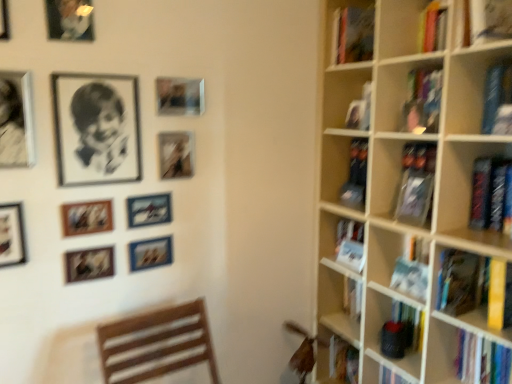
Identify the location of matte black picture frame at lower left, marked as the 1th picture frame in a bottom-to-top arrangement. (89, 264).

Where is `matte black picture frame at left, acting as the eighth picture frame starting from the top`? Image resolution: width=512 pixels, height=384 pixels. matte black picture frame at left, acting as the eighth picture frame starting from the top is located at coordinates (12, 235).

I want to click on hardcover book at upper right, which appears as the first book when viewed from the top, so click(488, 20).

What is the approximate height of metallic silver photo frame at center-left, arranged as the second picture frame when ordered from the bottom?

5.15 inches.

This screenshot has height=384, width=512. What do you see at coordinates (179, 96) in the screenshot?
I see `matte black picture frame at upper center, positioned as the eighth picture frame in bottom-to-top order` at bounding box center [179, 96].

How much space does matte black picture frame at upper center, the 6th picture frame from the bottom, occupy vertically?

It is 7.77 inches.

Find the location of a particular element. The image size is (512, 384). wooden bookcase at right is located at coordinates (399, 192).

Does blue hardcover book at upper right, which is the third book in bottom-to-top order, have a lesser width compared to matte black picture frame at upper center, the fifth picture frame when ordered from top to bottom?

In fact, blue hardcover book at upper right, which is the third book in bottom-to-top order, might be wider than matte black picture frame at upper center, the fifth picture frame when ordered from top to bottom.

Is blue hardcover book at upper right, which is the third book in bottom-to-top order, in contact with matte black picture frame at upper center, the 6th picture frame from the bottom?

blue hardcover book at upper right, which is the third book in bottom-to-top order, is not next to matte black picture frame at upper center, the 6th picture frame from the bottom, and they're not touching.

Can you tell me how much blue hardcover book at upper right, which is the third book in bottom-to-top order, and matte black picture frame at upper center, the 6th picture frame from the bottom, differ in facing direction?

90.6 degrees.

Is blue hardcover book at upper right, arranged as the 2th book when viewed from the top, at the right side of matte black picture frame at upper center, the fifth picture frame when ordered from top to bottom?

Yes, blue hardcover book at upper right, arranged as the 2th book when viewed from the top, is to the right of matte black picture frame at upper center, the fifth picture frame when ordered from top to bottom.

Find the location of `picture frame that is the 3rd object to the left of the black and white portrait at upper left, starting at the anchor`. picture frame that is the 3rd object to the left of the black and white portrait at upper left, starting at the anchor is located at coordinates (70, 20).

Is black and white portrait at upper left to the left or to the right of matte black picture frame at upper left, the tenth picture frame positioned from the bottom, in the image?

From the image, it's evident that black and white portrait at upper left is to the right of matte black picture frame at upper left, the tenth picture frame positioned from the bottom.

Are black and white portrait at upper left and matte black picture frame at upper left, the 1th picture frame in the top-to-bottom sequence, beside each other?

No, black and white portrait at upper left is not touching matte black picture frame at upper left, the 1th picture frame in the top-to-bottom sequence.

Looking at their sizes, would you say black and white portrait at upper left is wider or thinner than matte black picture frame at upper left, the tenth picture frame positioned from the bottom?

black and white portrait at upper left is wider than matte black picture frame at upper left, the tenth picture frame positioned from the bottom.

From the image's perspective, is metallic silver picture frame at upper left, which ranks as the ninth picture frame in bottom-to-top order, beneath blue hardcover book at upper right, which is the third book in bottom-to-top order?

Incorrect, from the image's perspective, metallic silver picture frame at upper left, which ranks as the ninth picture frame in bottom-to-top order, is higher than blue hardcover book at upper right, which is the third book in bottom-to-top order.

Consider the image. Which object is positioned more to the left, metallic silver picture frame at upper left, which ranks as the ninth picture frame in bottom-to-top order, or blue hardcover book at upper right, arranged as the 2th book when viewed from the top?

metallic silver picture frame at upper left, which ranks as the ninth picture frame in bottom-to-top order, is more to the left.

What's the angular difference between metallic silver picture frame at upper left, which is the 2th picture frame from top to bottom, and blue hardcover book at upper right, arranged as the 2th book when viewed from the top,'s facing directions?

They differ by 88.9 degrees in their facing directions.

Looking at this image, how distant is hardcover book at right, the first book in the bottom-to-top sequence, from metallic silver picture frame at upper left, which ranks as the ninth picture frame in bottom-to-top order?

The distance of hardcover book at right, the first book in the bottom-to-top sequence, from metallic silver picture frame at upper left, which ranks as the ninth picture frame in bottom-to-top order, is 2.06 meters.

From the image's perspective, does hardcover book at right, the first book in the bottom-to-top sequence, appear higher than metallic silver picture frame at upper left, which ranks as the ninth picture frame in bottom-to-top order?

Incorrect, from the image's perspective, hardcover book at right, the first book in the bottom-to-top sequence, is lower than metallic silver picture frame at upper left, which ranks as the ninth picture frame in bottom-to-top order.

Looking at this image, who is bigger, hardcover book at right, the first book in the bottom-to-top sequence, or metallic silver picture frame at upper left, which ranks as the ninth picture frame in bottom-to-top order?

Bigger between the two is hardcover book at right, the first book in the bottom-to-top sequence.

Is matte black picture frame at upper center, the 6th picture frame from the bottom, situated inside metallic silver picture frame at upper left, which is the 2th picture frame from top to bottom, or outside?

matte black picture frame at upper center, the 6th picture frame from the bottom, exists outside the volume of metallic silver picture frame at upper left, which is the 2th picture frame from top to bottom.

Is matte black picture frame at upper center, the 6th picture frame from the bottom, positioned before metallic silver picture frame at upper left, which is the 2th picture frame from top to bottom?

No.

Could you tell me if matte black picture frame at upper center, the fifth picture frame when ordered from top to bottom, is facing metallic silver picture frame at upper left, which is the 2th picture frame from top to bottom?

No.

Is matte black picture frame at upper left, the 1th picture frame in the top-to-bottom sequence, to the left of metallic silver picture frame at upper left, which ranks as the 7th picture frame in bottom-to-top order, from the viewer's perspective?

No, matte black picture frame at upper left, the 1th picture frame in the top-to-bottom sequence, is not to the left of metallic silver picture frame at upper left, which ranks as the 7th picture frame in bottom-to-top order.

Does point (67, 8) appear closer or farther from the camera than point (30, 135)?

Clearly, point (67, 8) is closer to the camera than point (30, 135).

From the image's perspective, is matte black picture frame at upper left, the 1th picture frame in the top-to-bottom sequence, located beneath metallic silver picture frame at upper left, which ranks as the 7th picture frame in bottom-to-top order?

Incorrect, from the image's perspective, matte black picture frame at upper left, the 1th picture frame in the top-to-bottom sequence, is higher than metallic silver picture frame at upper left, which ranks as the 7th picture frame in bottom-to-top order.

Between matte black picture frame at left, positioned as the third picture frame in bottom-to-top order, and blue hardcover book at upper right, arranged as the 2th book when viewed from the top, which one has less height?

matte black picture frame at left, positioned as the third picture frame in bottom-to-top order.

From the image's perspective, is matte black picture frame at left, acting as the eighth picture frame starting from the top, over blue hardcover book at upper right, arranged as the 2th book when viewed from the top?

Incorrect, from the image's perspective, matte black picture frame at left, acting as the eighth picture frame starting from the top, is lower than blue hardcover book at upper right, arranged as the 2th book when viewed from the top.

Does matte black picture frame at left, acting as the eighth picture frame starting from the top, have a greater width compared to blue hardcover book at upper right, which is the third book in bottom-to-top order?

In fact, matte black picture frame at left, acting as the eighth picture frame starting from the top, might be narrower than blue hardcover book at upper right, which is the third book in bottom-to-top order.

Considering their positions, is matte black picture frame at left, acting as the eighth picture frame starting from the top, located in front of or behind blue hardcover book at upper right, which is the third book in bottom-to-top order?

Clearly, matte black picture frame at left, acting as the eighth picture frame starting from the top, is in front of blue hardcover book at upper right, which is the third book in bottom-to-top order.

From the image's perspective, starting from the blue hardcover book at upper right, which is the third book in bottom-to-top order, which picture frame is the 2nd one below? Please provide its 2D coordinates.

[(176, 154)]

From the black and white portrait at upper left, count 1st picture frames forward and point to it. Please provide its 2D coordinates.

[(70, 20)]

From the image, which object appears to be farther from metallic silver picture frame at upper left, which ranks as the ninth picture frame in bottom-to-top order, matte black picture frame at left, acting as the eighth picture frame starting from the top, or hardcover book at upper right, which appears as the first book when viewed from the top?

Among the two, hardcover book at upper right, which appears as the first book when viewed from the top, is located further to metallic silver picture frame at upper left, which ranks as the ninth picture frame in bottom-to-top order.

When comparing their distances from metallic silver photo frame at center-left, arranged as the ninth picture frame when viewed from the top, does hardcover books at right or metallic silver airplane at upper left, arranged as the 6th picture frame when viewed from the top, seem further?

hardcover books at right.

When comparing their distances from hardcover book at upper right, marked as the fourth book in a bottom-to-top arrangement, does wooden chair at lower left or blue hardcover book at upper right, arranged as the 2th book when viewed from the top, seem closer?

blue hardcover book at upper right, arranged as the 2th book when viewed from the top, is closer to hardcover book at upper right, marked as the fourth book in a bottom-to-top arrangement.

Considering their positions, is metallic silver picture frame at upper left, the 4th picture frame viewed from the top, positioned further to metallic silver picture frame at upper left, which is the 2th picture frame from top to bottom, than hardcover books at right?

hardcover books at right is further to metallic silver picture frame at upper left, which is the 2th picture frame from top to bottom.

Based on their spatial positions, is matte black picture frame at upper center, the 6th picture frame from the bottom, or matte black picture frame at upper center, arranged as the third picture frame when viewed from the top, closer to hardcover book at right, marked as the 4th book in a top-to-bottom arrangement?

Among the two, matte black picture frame at upper center, the 6th picture frame from the bottom, is located nearer to hardcover book at right, marked as the 4th book in a top-to-bottom arrangement.

Considering their positions, is metallic silver picture frame at upper left, the 4th picture frame viewed from the top, positioned further to metallic silver photo frame at center-left, arranged as the ninth picture frame when viewed from the top, than matte wooden picture frame at upper left, the 7th picture frame positioned from the top?

Among the two, metallic silver picture frame at upper left, the 4th picture frame viewed from the top, is located further to metallic silver photo frame at center-left, arranged as the ninth picture frame when viewed from the top.

Which object lies nearer to the anchor point hardcover book at upper right, which appears as the first book when viewed from the top, hardcover books at right or hardcover book at right, positioned as the third book in top-to-bottom order?

hardcover books at right is positioned closer to the anchor hardcover book at upper right, which appears as the first book when viewed from the top.

In the scene shown: Based on their spatial positions, is metallic silver picture frame at upper left, which ranks as the 7th picture frame in bottom-to-top order, or metallic silver airplane at upper left, arranged as the 6th picture frame when viewed from the top, closer to hardcover book at upper right, marked as the fourth book in a bottom-to-top arrangement?

The object closer to hardcover book at upper right, marked as the fourth book in a bottom-to-top arrangement, is metallic silver airplane at upper left, arranged as the 6th picture frame when viewed from the top.

Identify the location of bookcase located between matte black picture frame at upper center, positioned as the eighth picture frame in bottom-to-top order, and hardcover book at right, positioned as the third book in top-to-bottom order, in the left-right direction. The image size is (512, 384). (399, 192).

Identify the location of chair located between black and white portrait at upper left and wooden bookcase at right in the left-right direction. (156, 344).

Where is `person between matte black picture frame at lower left, arranged as the 10th picture frame when viewed from the top, and wooden bookcase at right, in the horizontal direction`? This screenshot has width=512, height=384. person between matte black picture frame at lower left, arranged as the 10th picture frame when viewed from the top, and wooden bookcase at right, in the horizontal direction is located at coordinates (99, 127).

At what (x,y) coordinates should I click in order to perform the action: click on book between matte black picture frame at upper left, the tenth picture frame positioned from the bottom, and hardcover book at right, positioned as the third book in top-to-bottom order. Please return your answer as a coordinate pair (x, y). The width and height of the screenshot is (512, 384). Looking at the image, I should click on (488, 20).